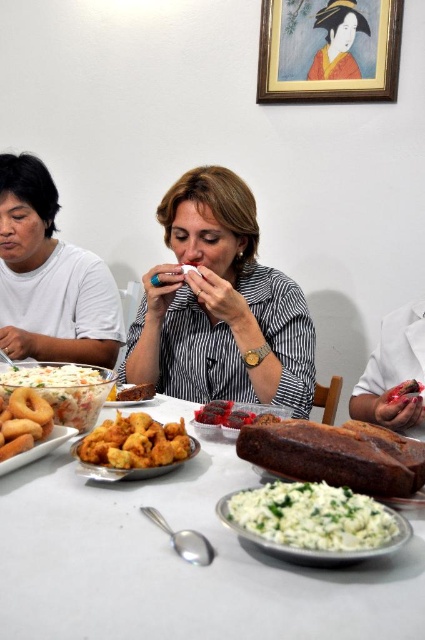
You are a waiter at a restaurant and need to place a dessert plate between the matte black shirt at center and the white crumbly cheese at center. The dessert plate has a diameter of 12 inches. Can you fit it between them without moving either object?

The distance between the matte black shirt at center and the white crumbly cheese at center is 28.26 inches. Since the dessert plate requires 12 inches of space, there is enough room to place it between them without moving either object.

You are a guest at a dinner and want to reach for the item that is taller between the brown crusty loaf of bread at center and the golden fried nuggets at center. Which one should you choose?

The brown crusty loaf of bread at center is taller than the golden fried nuggets at center, so you should choose the brown crusty loaf of bread at center.

You are a food delivery person who needs to place a new order on the table. The table has limited space. You have to choose between placing the new plate either to the left of the white matte shirt at left or to the right of the golden crispy onion rings at lower left. Which side has more space?

The white matte shirt at left is bigger than golden crispy onion rings at lower left, so the right side of the golden crispy onion rings at lower left has more space available for placing the new plate.